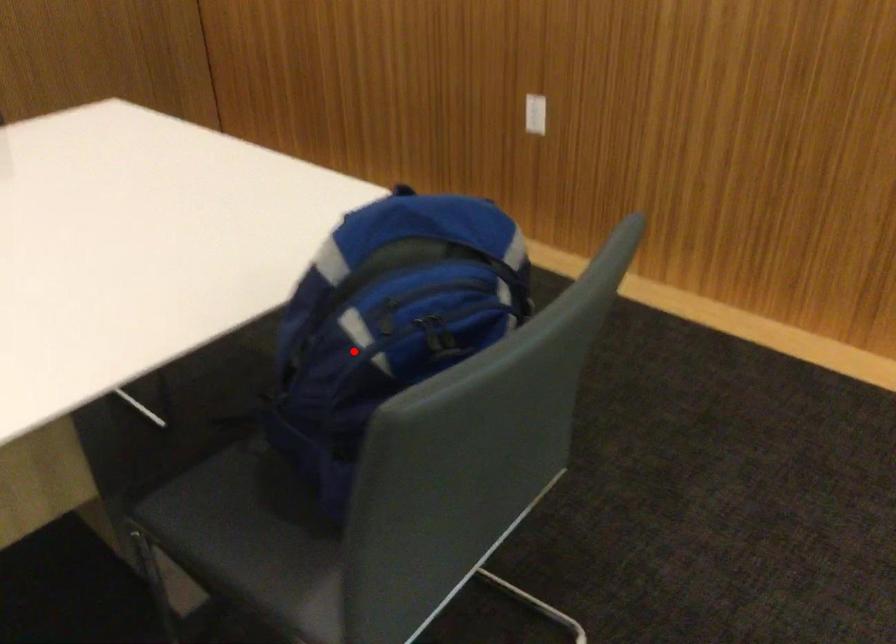
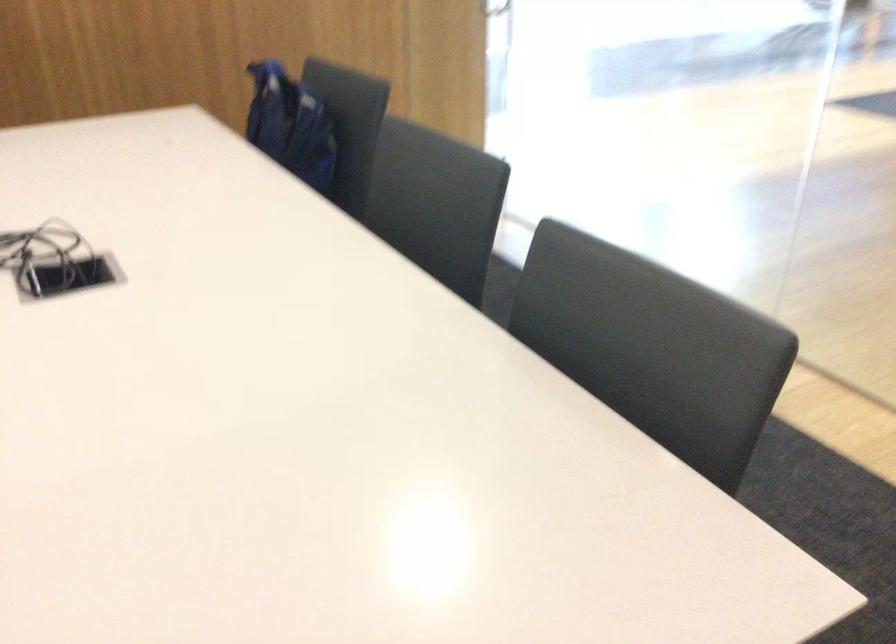
Question: I am providing you with two images of the same scene from different viewpoints. A red point is shown in image1. For the corresponding object point in image2, is it positioned nearer or farther from the camera?

Choices:
 (A) Nearer
 (B) Farther

Answer: (B)